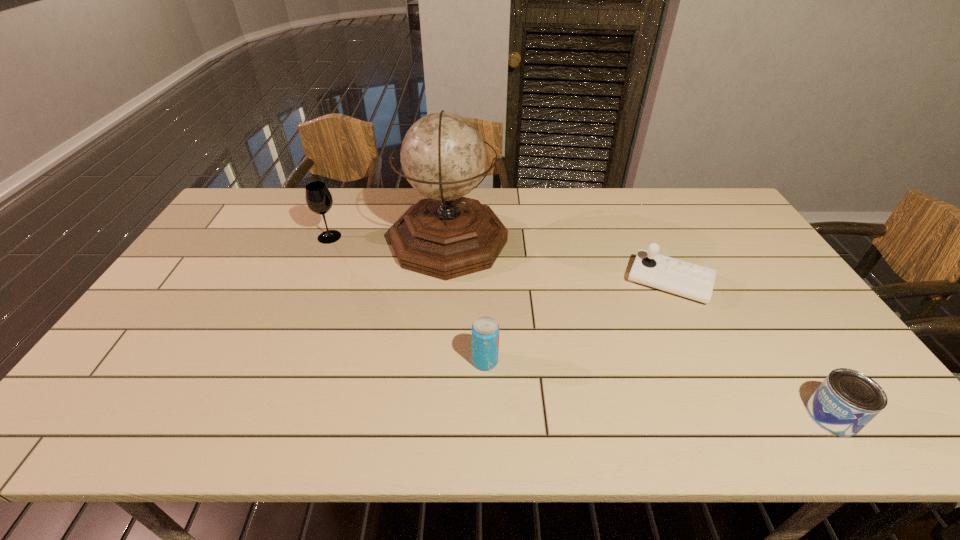
Locate an element on the screen. The height and width of the screenshot is (540, 960). free space between the tallest object and the joystick is located at coordinates (559, 261).

Identify the location of vacant area between the second object from right to left and the soda can. (577, 322).

This screenshot has height=540, width=960. I want to click on free space that is in between the fourth farthest object and the globe, so click(467, 301).

The width and height of the screenshot is (960, 540). In order to click on the second closest object to the soda can in this screenshot , I will do `click(675, 276)`.

You are a GUI agent. You are given a task and a screenshot of the screen. Output one action in this format:
    pyautogui.click(x=<x>, y=<y>)
    Task: Click on the object that stands as the second closest to the fourth object from left to right
    This screenshot has height=540, width=960.
    Given the screenshot: What is the action you would take?
    pyautogui.click(x=443, y=156)

Where is `free space that satisfies the following two spatial constraints: 1. on the surface of the globe; 2. on the back side of the second nearest object`? The image size is (960, 540). free space that satisfies the following two spatial constraints: 1. on the surface of the globe; 2. on the back side of the second nearest object is located at coordinates (438, 361).

Where is `vacant region that satisfies the following two spatial constraints: 1. on the surface of the tallest object; 2. on the left side of the fourth farthest object`? vacant region that satisfies the following two spatial constraints: 1. on the surface of the tallest object; 2. on the left side of the fourth farthest object is located at coordinates (438, 361).

You are a GUI agent. You are given a task and a screenshot of the screen. Output one action in this format:
    pyautogui.click(x=<x>, y=<y>)
    Task: Click on the vacant region that satisfies the following two spatial constraints: 1. on the surface of the fourth farthest object; 2. on the left side of the tallest object
    
    Given the screenshot: What is the action you would take?
    pyautogui.click(x=438, y=361)